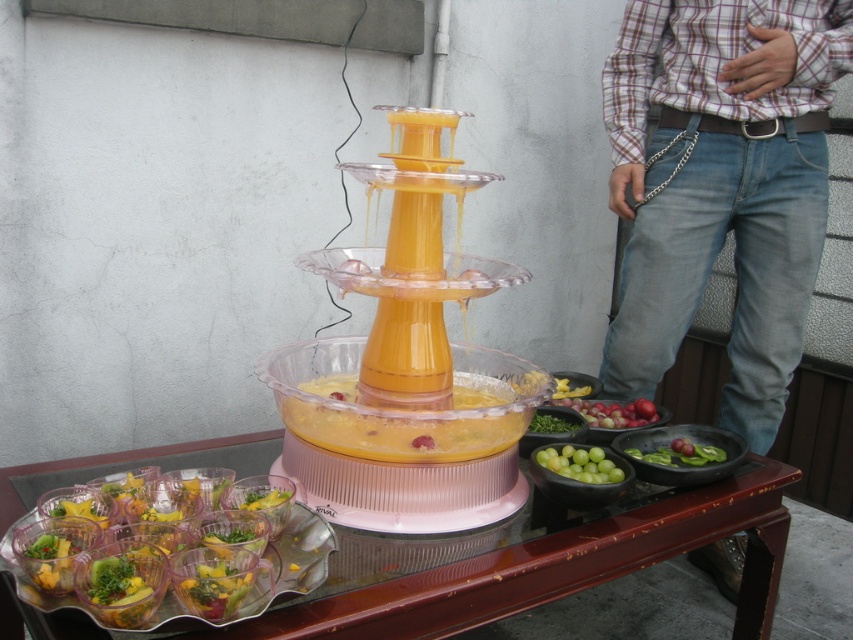
Question: Which object appears farthest from the camera in this image?

Choices:
 (A) green leafy vegetables at center
 (B) translucent plastic cups at lower left

Answer: (A)

Question: Is clear plastic tray at lower center behind green leafy vegetables at center?

Choices:
 (A) yes
 (B) no

Answer: (B)

Question: Among these points, which one is nearest to the camera?

Choices:
 (A) [x=671, y=506]
 (B) [x=637, y=292]

Answer: (A)

Question: Can you confirm if denim jeans at right is thinner than green leafy vegetables at center?

Choices:
 (A) yes
 (B) no

Answer: (B)

Question: Which point appears farthest from the camera in this image?

Choices:
 (A) (567, 428)
 (B) (682, 152)

Answer: (B)

Question: Can you confirm if clear plastic tray at lower center is positioned above green matte grapes at lower center?

Choices:
 (A) no
 (B) yes

Answer: (A)